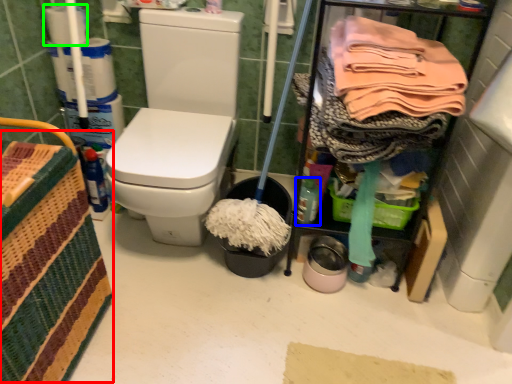
Question: Considering the real-world distances, which object is closest to basket (highlighted by a red box)? bottle (highlighted by a blue box) or toilet paper (highlighted by a green box).

Choices:
 (A) bottle
 (B) toilet paper

Answer: (A)